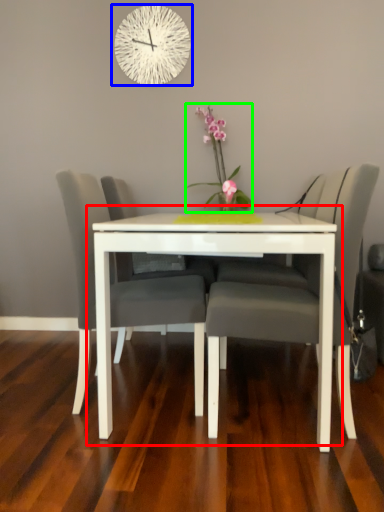
Question: Estimate the real-world distances between objects in this image. Which object is closer to table (highlighted by a red box), wall clock (highlighted by a blue box) or floral arrangement (highlighted by a green box)?

Choices:
 (A) wall clock
 (B) floral arrangement

Answer: (B)